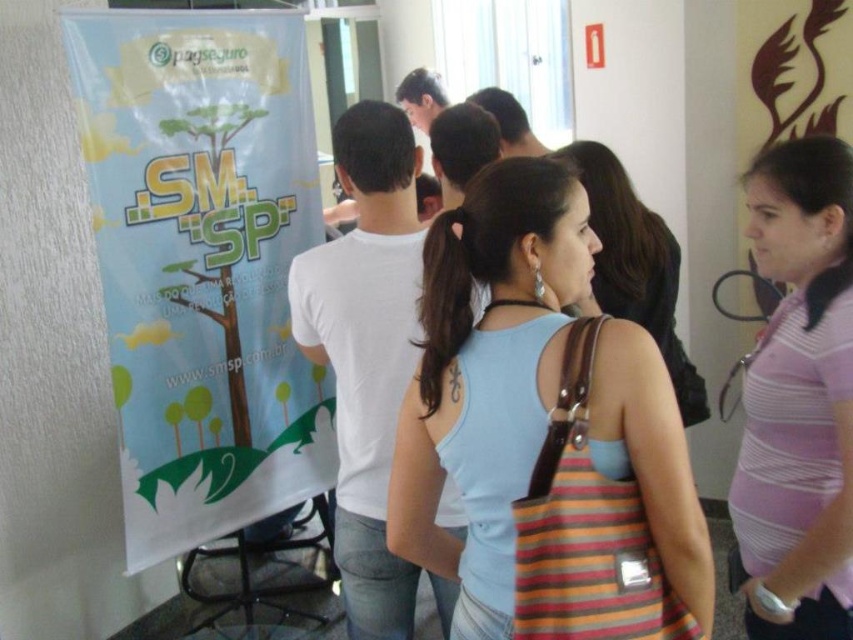
Looking at this image, which is above, light blue tank top at center or pink striped shirt at center?

Positioned higher is light blue tank top at center.

This screenshot has height=640, width=853. I want to click on light blue tank top at center, so click(544, 433).

Between point (532, 236) and point (808, 317), which one is positioned behind?

The point (808, 317) is behind.

Find the location of a particular element. This screenshot has width=853, height=640. light blue tank top at center is located at coordinates (544, 433).